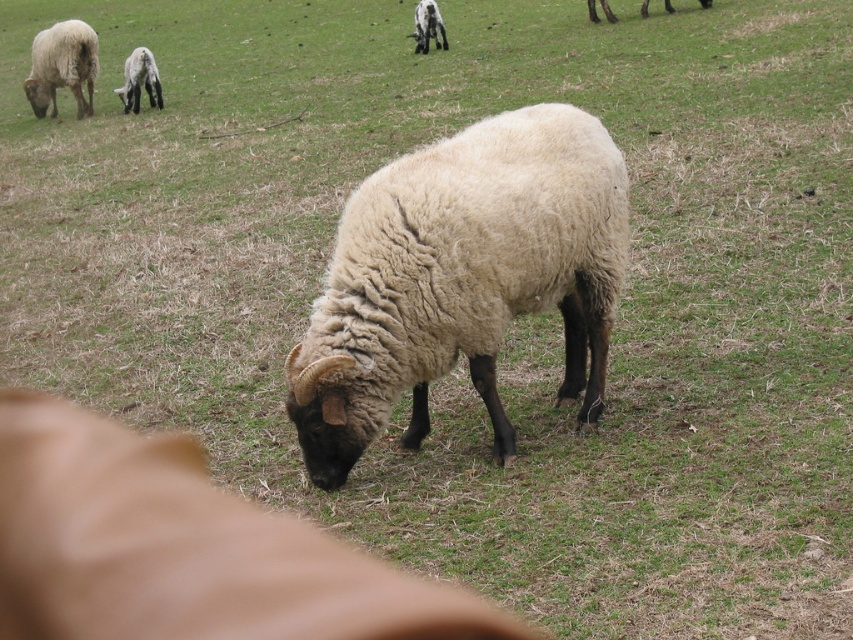
Does point (376, 563) come farther from viewer compared to point (433, 4)?

No, (376, 563) is in front of (433, 4).

Which is in front, point (68, 448) or point (427, 48)?

Point (68, 448)

At what (x,y) coordinates should I click in order to perform the action: click on smooth leather dog at center. Please return your answer as a coordinate pair (x, y). This screenshot has height=640, width=853. Looking at the image, I should click on (183, 548).

Which is more to the left, white woolen sheep at upper left or white woolen sheep at center?

From the viewer's perspective, white woolen sheep at upper left appears more on the left side.

Between white woolen sheep at upper left and white woolen sheep at center, which one is positioned higher?

white woolen sheep at center

This screenshot has width=853, height=640. What do you see at coordinates (138, 81) in the screenshot?
I see `white woolen sheep at upper left` at bounding box center [138, 81].

Find the location of `white woolen sheep at upper left`. white woolen sheep at upper left is located at coordinates (138, 81).

Which of these two, white woolly sheep at upper left or white woolen sheep at center, stands shorter?

With less height is white woolen sheep at center.

Does white woolly sheep at upper left have a lesser height compared to white woolen sheep at center?

No.

Does point (53, 100) come farther from viewer compared to point (422, 3)?

No.

The image size is (853, 640). Find the location of `white woolly sheep at upper left`. white woolly sheep at upper left is located at coordinates (62, 67).